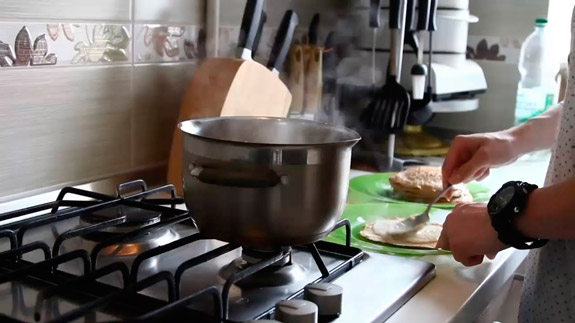
Locate an element on the screen. This screenshot has height=323, width=575. spoon is located at coordinates (410, 226).